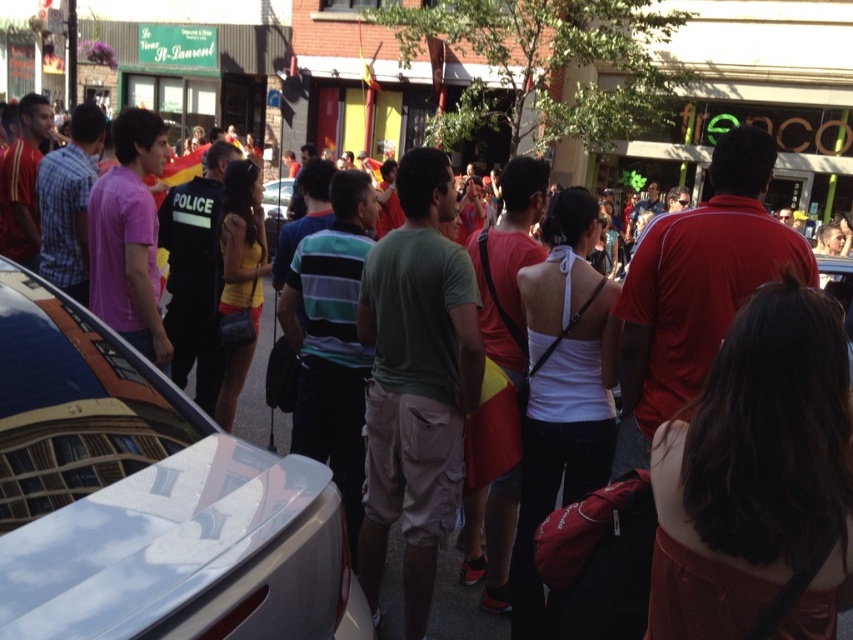
Who is taller, shiny silver car at center-left or green cotton t-shirt at center?

green cotton t-shirt at center is taller.

Does point (271, 598) come in front of point (381, 412)?

Yes, point (271, 598) is closer to viewer.

Locate an element on the screen. This screenshot has width=853, height=640. shiny silver car at center-left is located at coordinates (148, 499).